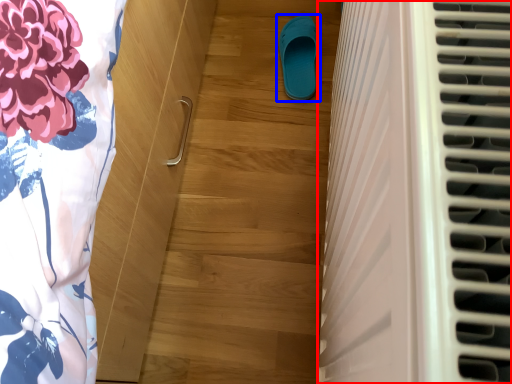
Question: Which of the following is the closest to the observer, air conditioning (highlighted by a red box) or footwear (highlighted by a blue box)?

Choices:
 (A) air conditioning
 (B) footwear

Answer: (A)